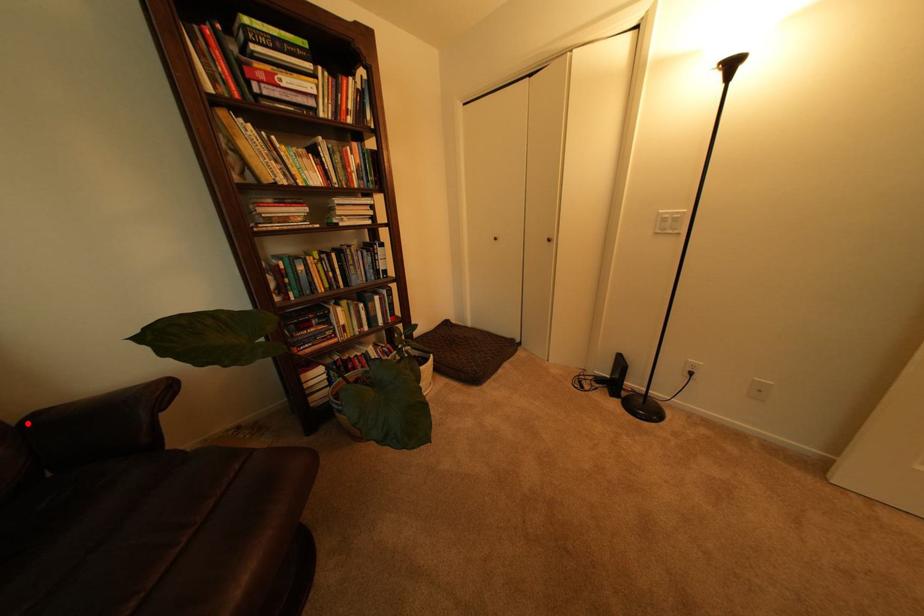
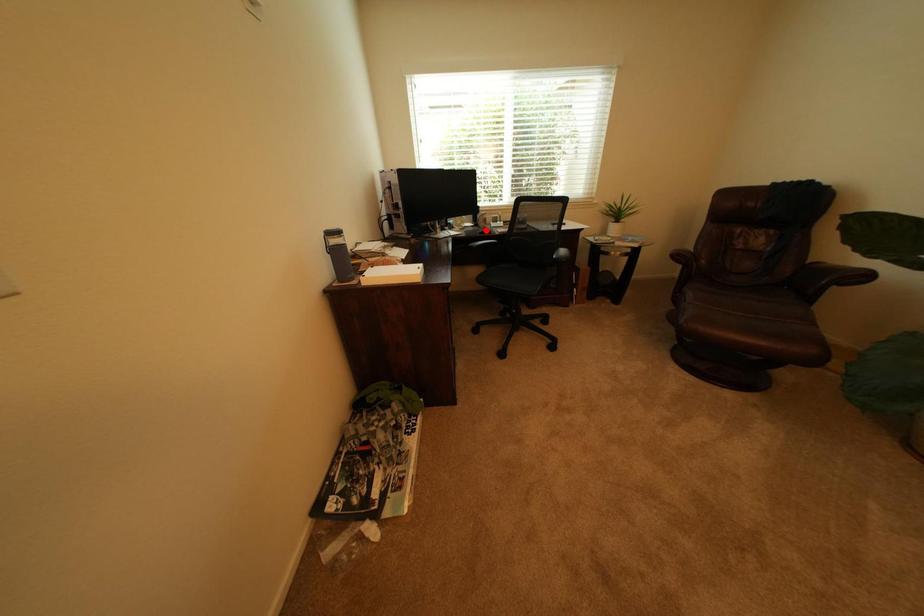
I am providing you with two images of the same scene from different viewpoints. A red point is marked on the first image and another point is marked on the second image. Is the red point in image1 aligned with the point shown in image2?

No